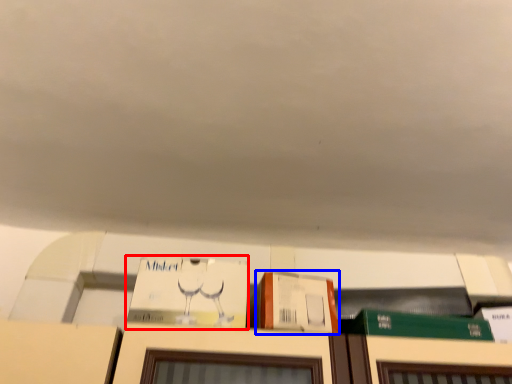
Question: Among these objects, which one is nearest to the camera, book (highlighted by a red box) or cardboard box (highlighted by a blue box)?

Choices:
 (A) book
 (B) cardboard box

Answer: (B)